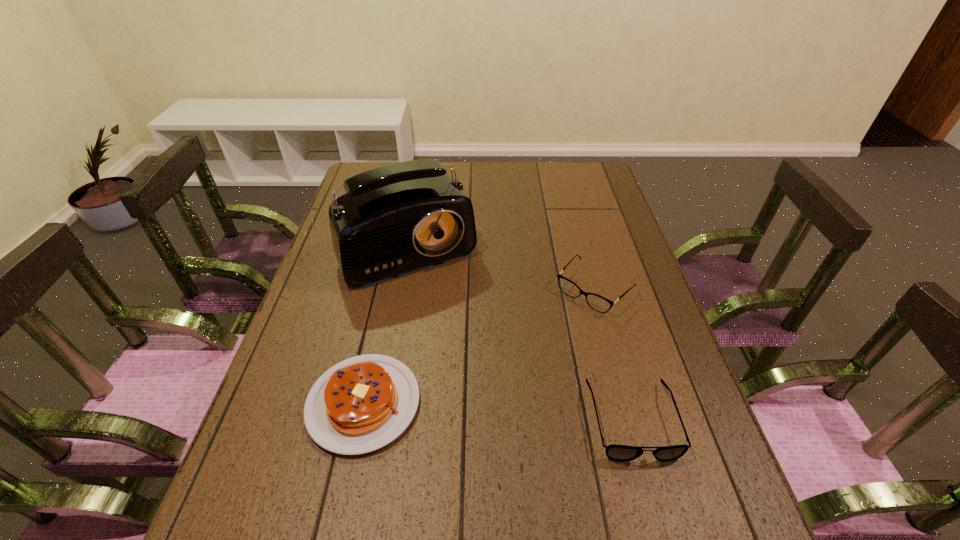
This screenshot has width=960, height=540. I want to click on blank region between the farther spectacles and the tallest object, so click(503, 265).

At what (x,y) coordinates should I click in order to perform the action: click on vacant space that is in between the nearer spectacles and the pancake. Please return your answer as a coordinate pair (x, y). Image resolution: width=960 pixels, height=540 pixels. Looking at the image, I should click on (498, 411).

Locate which object ranks third in proximity to the nearer spectacles. Please provide its 2D coordinates. Your answer should be formatted as a tuple, i.e. [(x, y)], where the tuple contains the x and y coordinates of a point satisfying the conditions above.

[(396, 219)]

Locate which object is the closest to the tallest object. Please provide its 2D coordinates. Your answer should be formatted as a tuple, i.e. [(x, y)], where the tuple contains the x and y coordinates of a point satisfying the conditions above.

[(568, 287)]